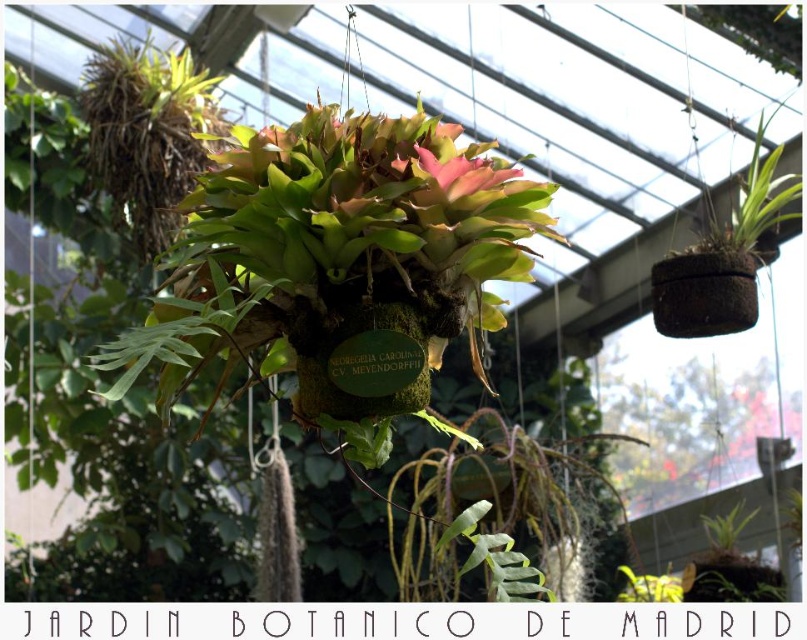
Can you confirm if green mossy hanging basket at center is smaller than pink matte flower at center?

Incorrect, green mossy hanging basket at center is not smaller in size than pink matte flower at center.

The width and height of the screenshot is (807, 640). What do you see at coordinates (333, 264) in the screenshot? I see `green mossy hanging basket at center` at bounding box center [333, 264].

The image size is (807, 640). Find the location of `green mossy hanging basket at center`. green mossy hanging basket at center is located at coordinates (333, 264).